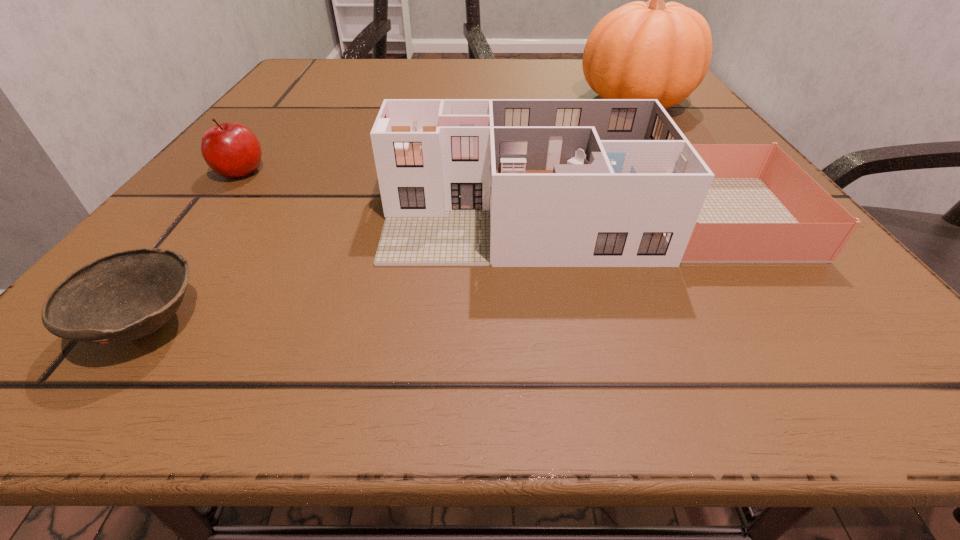
Identify the location of vacant area at the far edge of the desktop. (508, 66).

Locate an element on the screen. vacant region at the near edge is located at coordinates (588, 307).

You are a GUI agent. You are given a task and a screenshot of the screen. Output one action in this format:
    pyautogui.click(x=<x>, y=<y>)
    Task: Click on the free space at the left edge of the desktop
    The width and height of the screenshot is (960, 540).
    Given the screenshot: What is the action you would take?
    pyautogui.click(x=163, y=223)

Identify the location of vacant space at the near left corner of the desktop. The image size is (960, 540). (167, 328).

At what (x,y) coordinates should I click in order to perform the action: click on vacant space at the near right corner. Please return your answer as a coordinate pair (x, y). This screenshot has height=540, width=960. Looking at the image, I should click on (851, 363).

Locate an element on the screen. free space between the nearest object and the apple is located at coordinates (193, 248).

This screenshot has width=960, height=540. What are the coordinates of `free spot between the nearest object and the second tallest object` in the screenshot? It's located at (367, 271).

Where is `free space between the nearest object and the apple`? The width and height of the screenshot is (960, 540). free space between the nearest object and the apple is located at coordinates (193, 248).

This screenshot has height=540, width=960. I want to click on free spot between the nearest object and the apple, so click(x=193, y=248).

You are a GUI agent. You are given a task and a screenshot of the screen. Output one action in this format:
    pyautogui.click(x=<x>, y=<y>)
    Task: Click on the free space between the third tallest object and the bowl
    This screenshot has height=540, width=960.
    Given the screenshot: What is the action you would take?
    pyautogui.click(x=193, y=248)